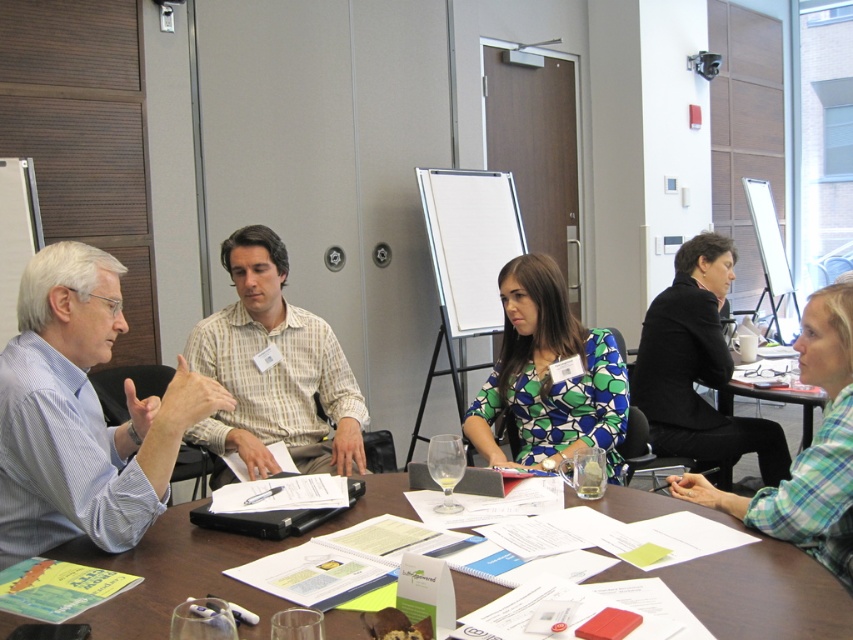
Between blue striped shirt at left and black matte jacket at upper right, which one has less height?

Standing shorter between the two is blue striped shirt at left.

From the picture: Is blue striped shirt at left shorter than black matte jacket at upper right?

Yes, blue striped shirt at left is shorter than black matte jacket at upper right.

This screenshot has width=853, height=640. Identify the location of blue striped shirt at left. (82, 413).

Which is more to the left, blue striped shirt at left or white paper at center?

blue striped shirt at left is more to the left.

Is point (102, 336) positioned behind point (363, 477)?

That is False.

The height and width of the screenshot is (640, 853). What are the coordinates of `blue striped shirt at left` in the screenshot? It's located at (82, 413).

What are the coordinates of `blue striped shirt at left` in the screenshot? It's located at (82, 413).

Which of these two, white paper at center or light brown striped shirt at center, stands shorter?

With less height is white paper at center.

From the picture: Is white paper at center shorter than light brown striped shirt at center?

Yes, white paper at center is shorter than light brown striped shirt at center.

Measure the distance between white paper at center and camera.

white paper at center and camera are 3.83 feet apart.

Where is `white paper at center`? This screenshot has height=640, width=853. white paper at center is located at coordinates (173, 577).